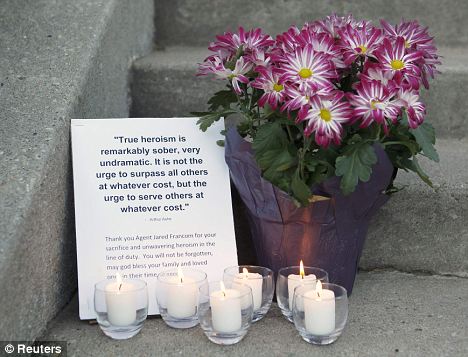
This screenshot has height=357, width=468. Find the location of `white candles`. white candles is located at coordinates (128, 310), (182, 295), (222, 315), (260, 294), (288, 285), (321, 315).